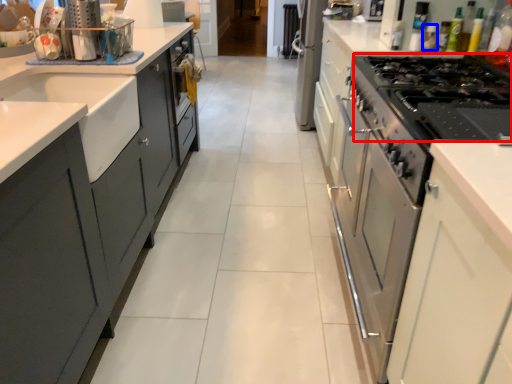
Question: Which object appears closest to the camera in this image, gas stove (highlighted by a red box) or bottle (highlighted by a blue box)?

Choices:
 (A) gas stove
 (B) bottle

Answer: (A)